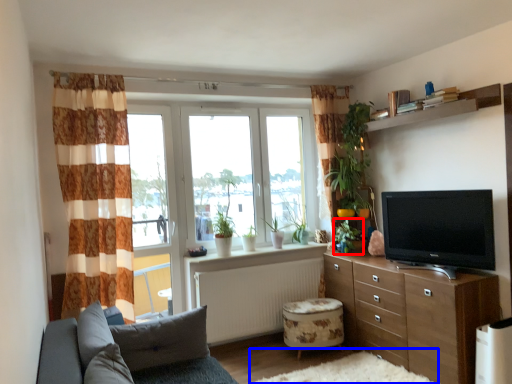
Question: Which of the following is the closest to the observer, plant (highlighted by a red box) or plain (highlighted by a blue box)?

Choices:
 (A) plant
 (B) plain

Answer: (B)